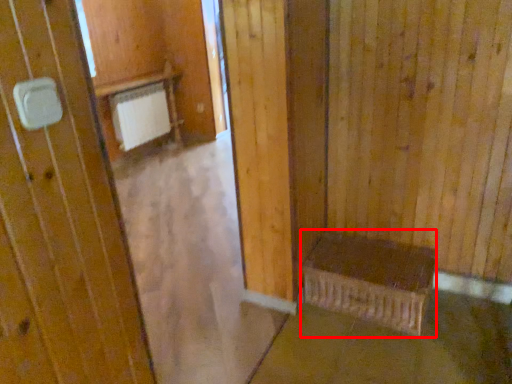
Question: From the image's perspective, considering the relative positions of furniture (annotated by the red box) and concrete in the image provided, where is furniture (annotated by the red box) located with respect to the staircase?

Choices:
 (A) below
 (B) above

Answer: (B)